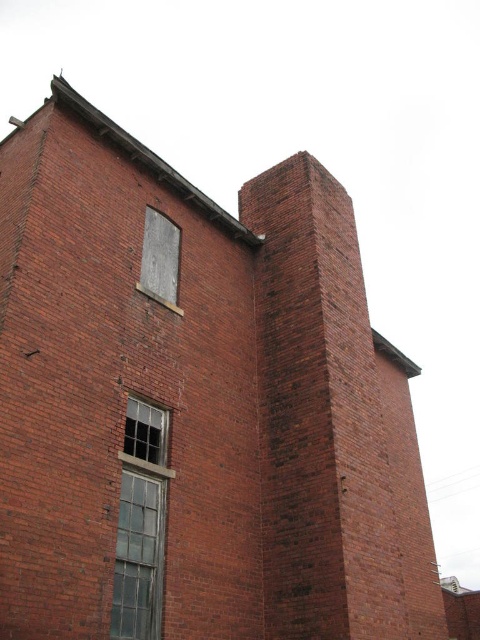
You are standing outside the building and want to look through the clear glass window at center and the gray concrete window at upper center. Which window is positioned higher up on the building?

The gray concrete window at upper center is positioned higher up on the building than the clear glass window at center.

You are standing in front of a historic building and want to take a photo of the point at coordinates (159, 429). If your camera has a maximum focus range of 30 meters, will it be able to focus on that point?

The distance of point (159, 429) from the viewer is 28.35 meters, which is within the camera maximum focus range of 30 meters. So yes, the camera can focus on that point.

You are standing in front of the building and notice two points marked on the wall. The first point is at coordinate point (x=149, y=557) and the second is at point (x=166, y=288). Which point is closer to you?

Point (x=149, y=557) is closer to the viewer than point (x=166, y=288).